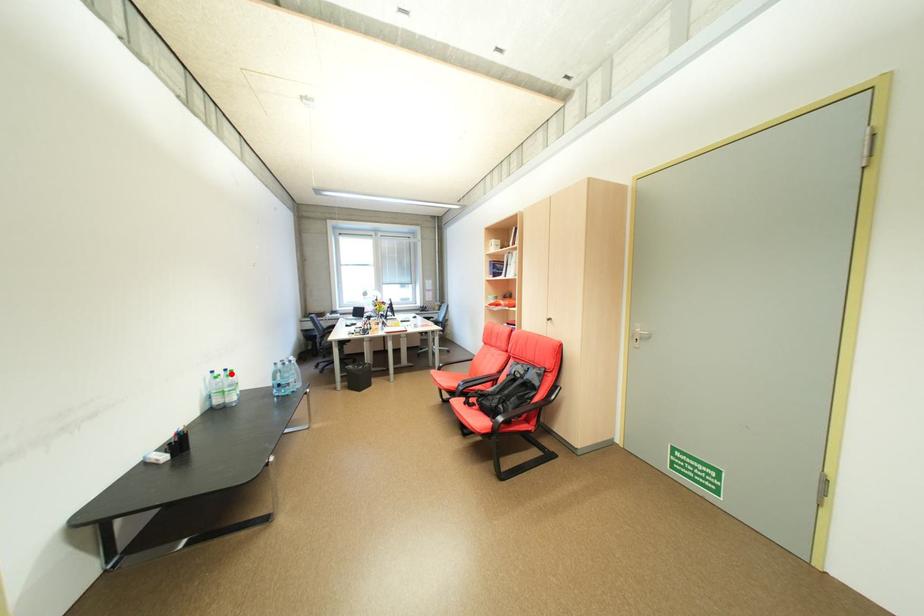
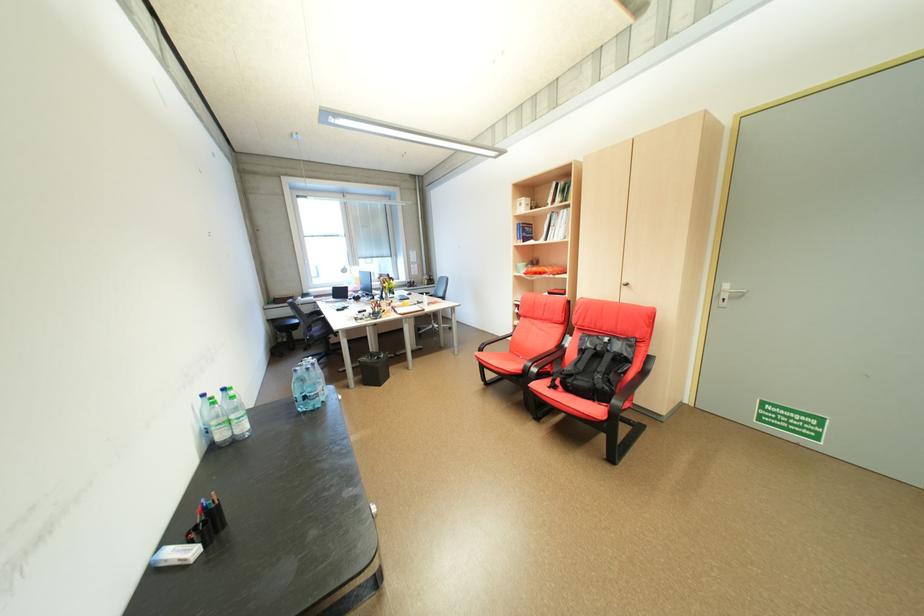
The point at the highlighted location is marked in the first image. Where is the corresponding point in the second image?

(228, 395)